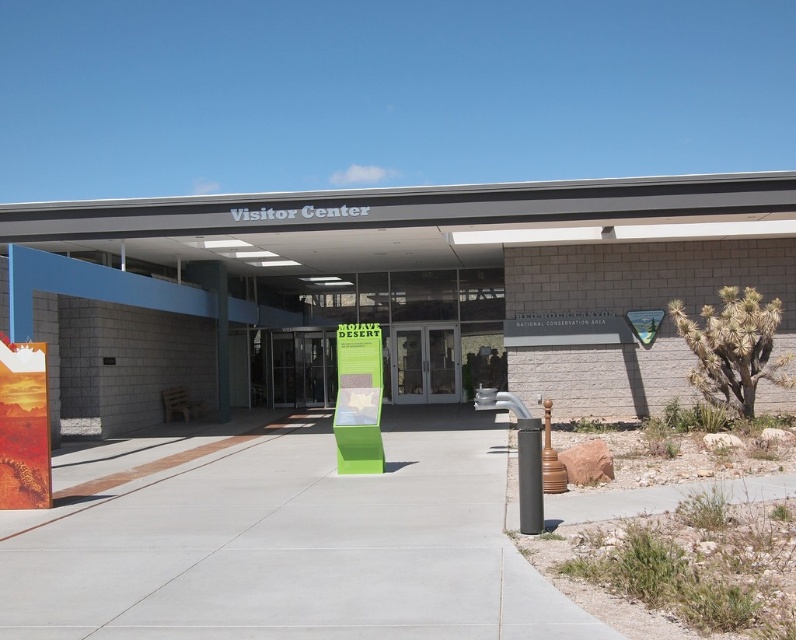
Question: Which object is closer to the camera taking this photo?

Choices:
 (A) gray concrete pavement at center
 (B) clear glass doors at center
 (C) black smooth pole at lower right

Answer: (A)

Question: Does clear glass doors at center appear on the right side of black smooth pole at lower right?

Choices:
 (A) yes
 (B) no

Answer: (B)

Question: Which of the following is the farthest from the observer?

Choices:
 (A) tap(525, 465)
 (B) tap(2, 560)

Answer: (A)

Question: Does gray concrete pavement at center appear over clear glass doors at center?

Choices:
 (A) yes
 (B) no

Answer: (B)

Question: Which point is farther from the camera taking this photo?

Choices:
 (A) (264, 428)
 (B) (434, 365)
 (C) (525, 484)

Answer: (B)

Question: Is clear glass doors at center in front of black smooth pole at lower right?

Choices:
 (A) no
 (B) yes

Answer: (A)